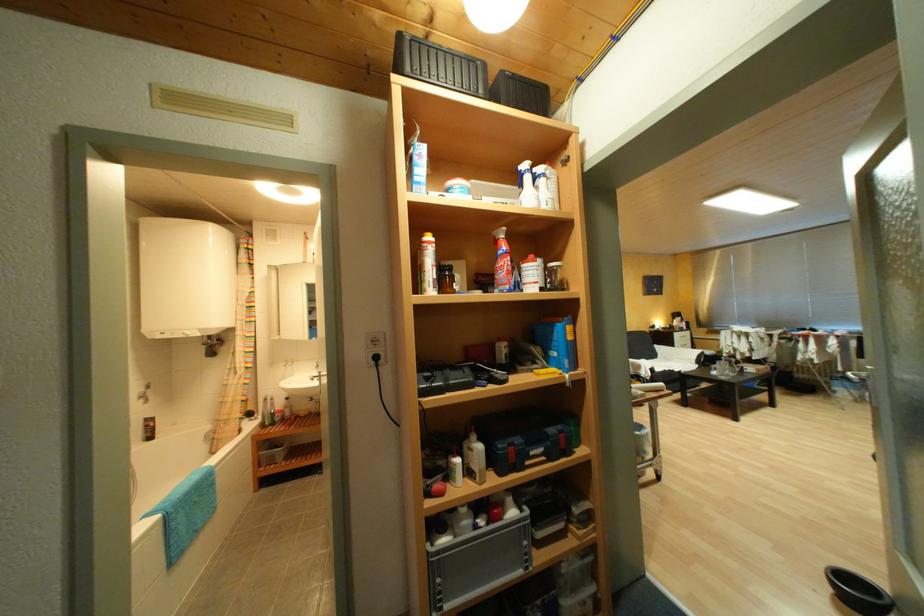
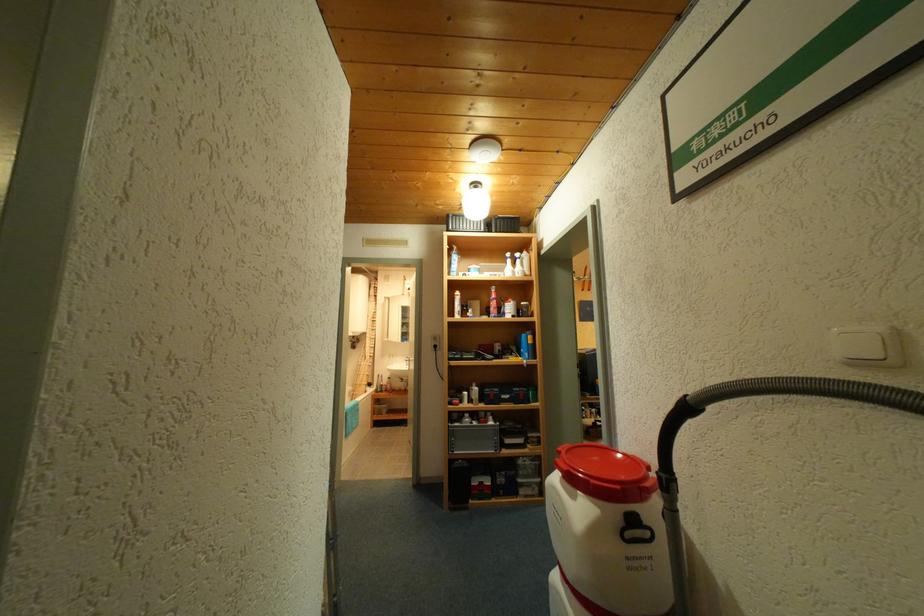
In a continuous first-person perspective shot, in which direction is the camera moving?

The cameraman moved toward right, backward.